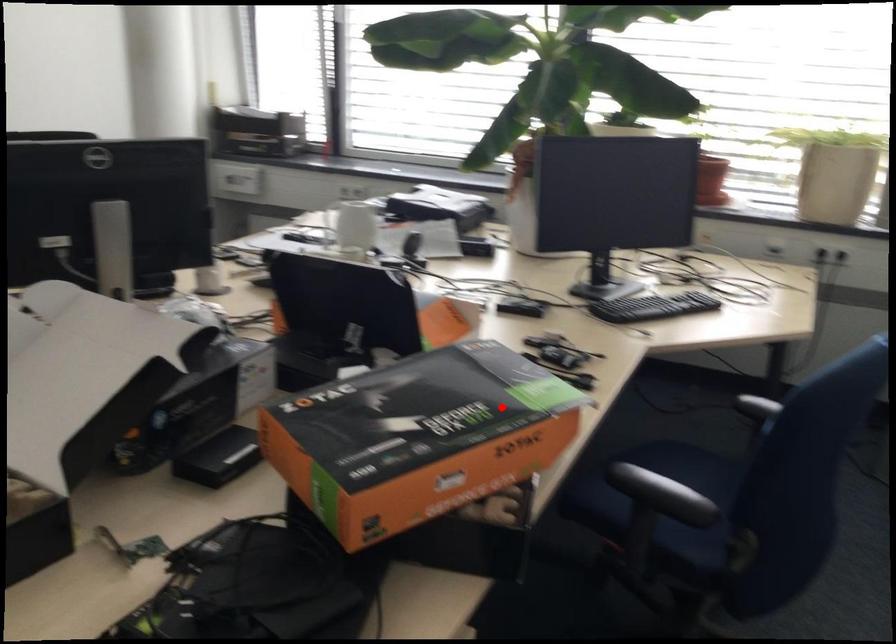
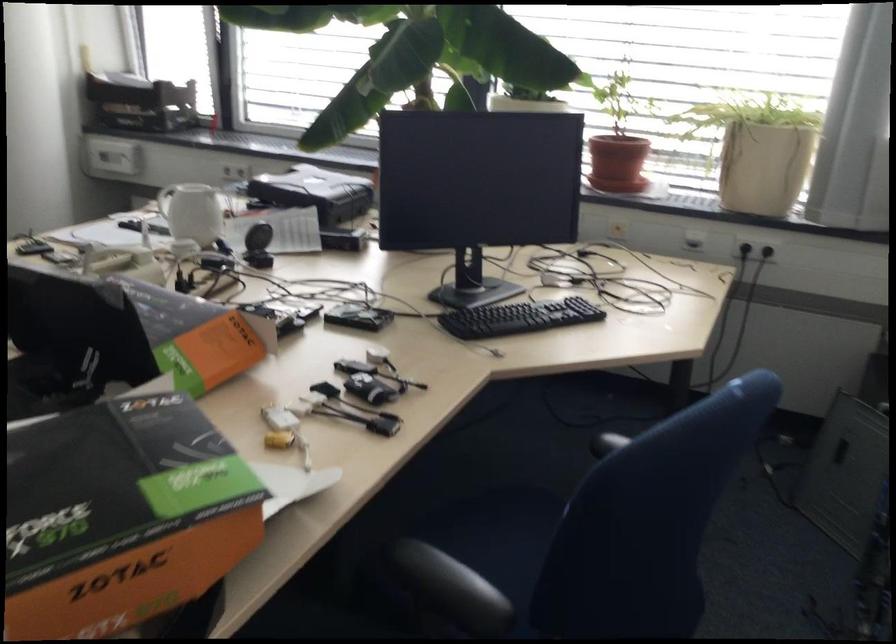
Find the pixel in the second image that matches the highlighted location in the first image.

(121, 516)